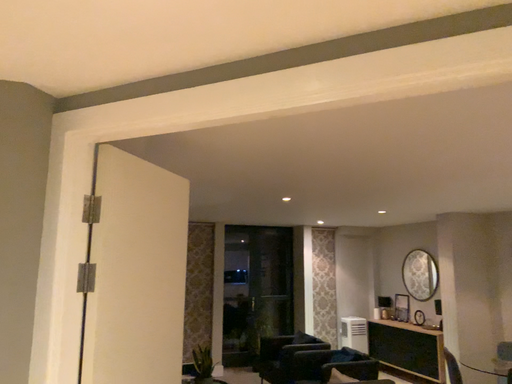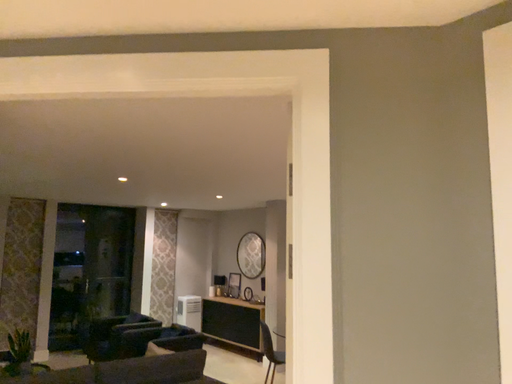
Question: How did the camera likely rotate when shooting the video?

Choices:
 (A) rotated right
 (B) rotated left

Answer: (A)